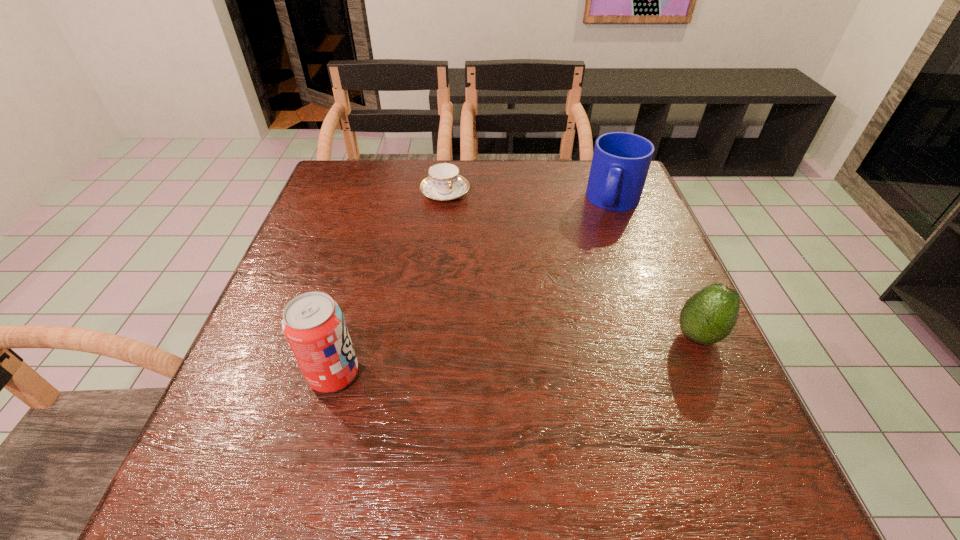
At what (x,y) coordinates should I click in order to perform the action: click on free spot that satisfies the following two spatial constraints: 1. on the back side of the leftmost object; 2. on the right side of the mug. Please return your answer as a coordinate pair (x, y). This screenshot has width=960, height=540. Looking at the image, I should click on (382, 201).

This screenshot has width=960, height=540. I want to click on vacant area in the image that satisfies the following two spatial constraints: 1. on the front side of the teacup; 2. on the left side of the avocado, so click(x=430, y=336).